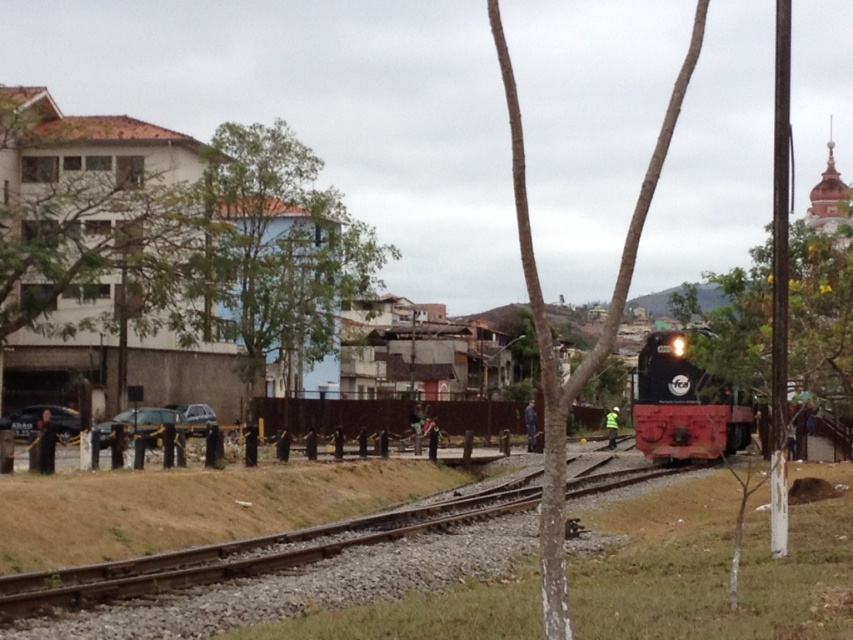
Measure the distance between point [132,612] and camera.

16.52 meters

From the picture: Between metal train track at center and smooth bark tree at center, which one has more height?

smooth bark tree at center is taller.

The width and height of the screenshot is (853, 640). Identify the location of metal train track at center. (267, 570).

Locate an element on the screen. metal train track at center is located at coordinates (267, 570).

Can you confirm if green leafy tree at upper left is positioned to the right of shiny black locomotive at center?

Incorrect, green leafy tree at upper left is not on the right side of shiny black locomotive at center.

Does green leafy tree at upper left appear over shiny black locomotive at center?

Yes.

What do you see at coordinates (276, 250) in the screenshot? This screenshot has width=853, height=640. I see `green leafy tree at upper left` at bounding box center [276, 250].

Where is `green leafy tree at upper left`? green leafy tree at upper left is located at coordinates pyautogui.click(x=276, y=250).

Image resolution: width=853 pixels, height=640 pixels. Find the location of `green leafy tree at upper left`. green leafy tree at upper left is located at coordinates (276, 250).

Image resolution: width=853 pixels, height=640 pixels. What do you see at coordinates (276, 250) in the screenshot? I see `green leafy tree at upper left` at bounding box center [276, 250].

Which is in front, point (328, 236) or point (761, 324)?

Point (761, 324) is in front.

Find the location of a particular element. Image resolution: width=853 pixels, height=640 pixels. green leafy tree at upper left is located at coordinates (276, 250).